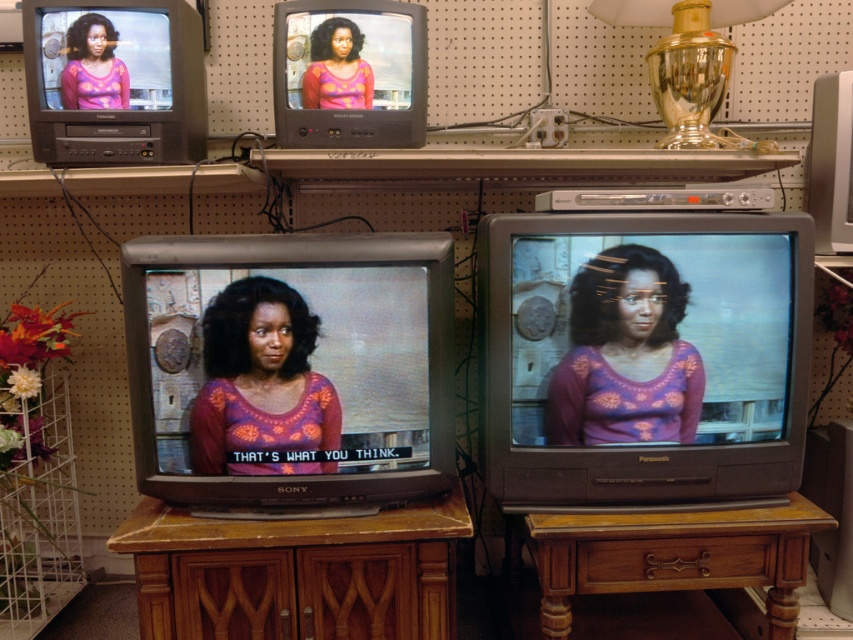
Question: Which point is farther to the camera?

Choices:
 (A) purple floral sweater at center
 (B) wooden table at lower right
 (C) gold glass lamp at upper right

Answer: (C)

Question: Considering the real-world distances, which object is closest to the matte purple sweater at upper left?

Choices:
 (A) matte purple blouse at center
 (B) purple floral sweater at center
 (C) gold glass lamp at upper right
 (D) matte purple sweater at center

Answer: (A)

Question: Which point is farther to the camera?

Choices:
 (A) (219, 328)
 (B) (647, 368)
 (C) (340, 56)
 (D) (675, 38)

Answer: (D)

Question: Is purple floral sweater at center to the left of matte purple blouse at center from the viewer's perspective?

Choices:
 (A) yes
 (B) no

Answer: (A)

Question: Does matte purple sweater at upper left appear over matte purple blouse at center?

Choices:
 (A) no
 (B) yes

Answer: (A)

Question: Is purple floral sweater at center thinner than matte purple blouse at center?

Choices:
 (A) no
 (B) yes

Answer: (A)